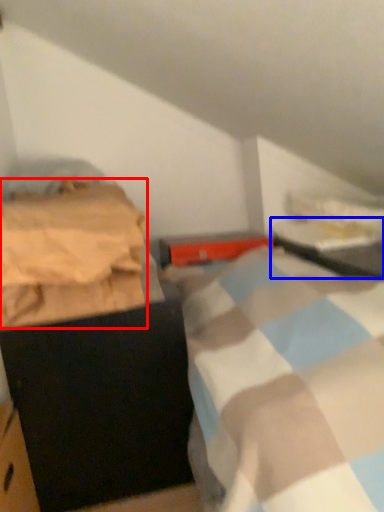
Question: Which object appears closest to the camera in this image, blanket (highlighted by a red box) or table (highlighted by a blue box)?

Choices:
 (A) blanket
 (B) table

Answer: (A)